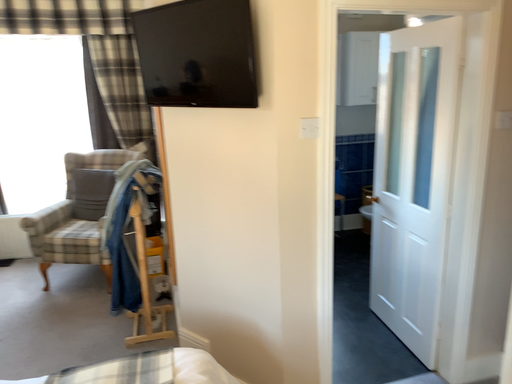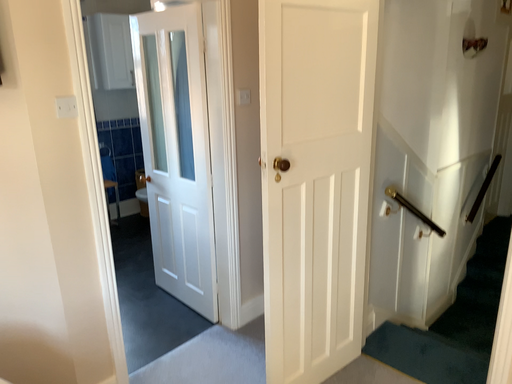
Question: Which way did the camera rotate in the video?

Choices:
 (A) rotated right
 (B) rotated left

Answer: (A)